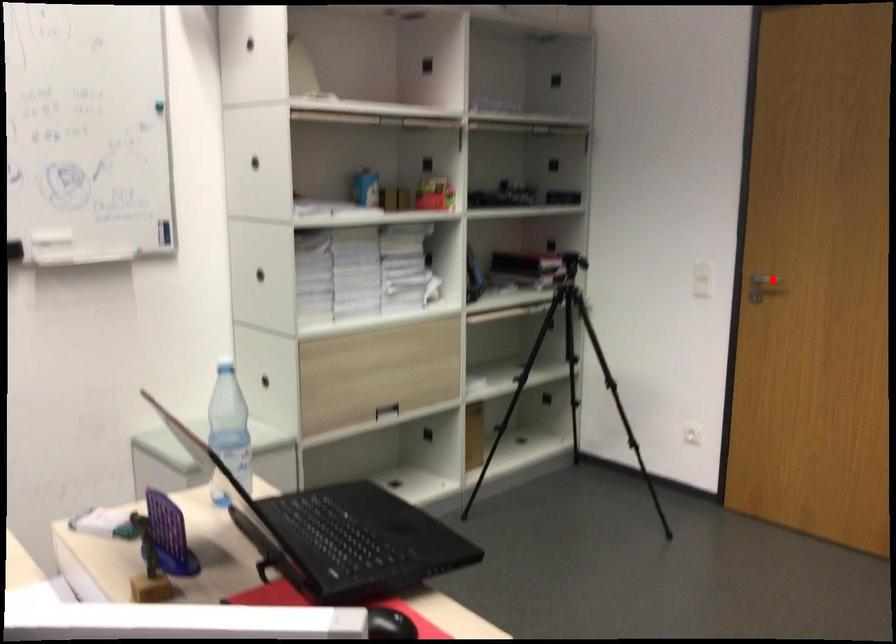
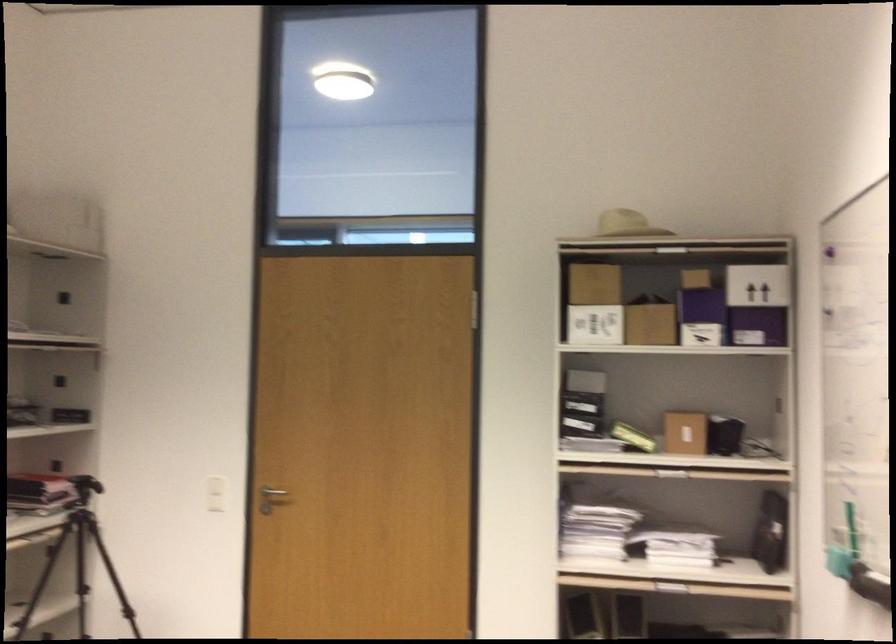
Question: I am providing you with two images of the same scene from different viewpoints. In image1, a red point is highlighted. Considering the same 3D point in image2, which of the following is correct?

Choices:
 (A) It is closer
 (B) It is farther

Answer: (B)